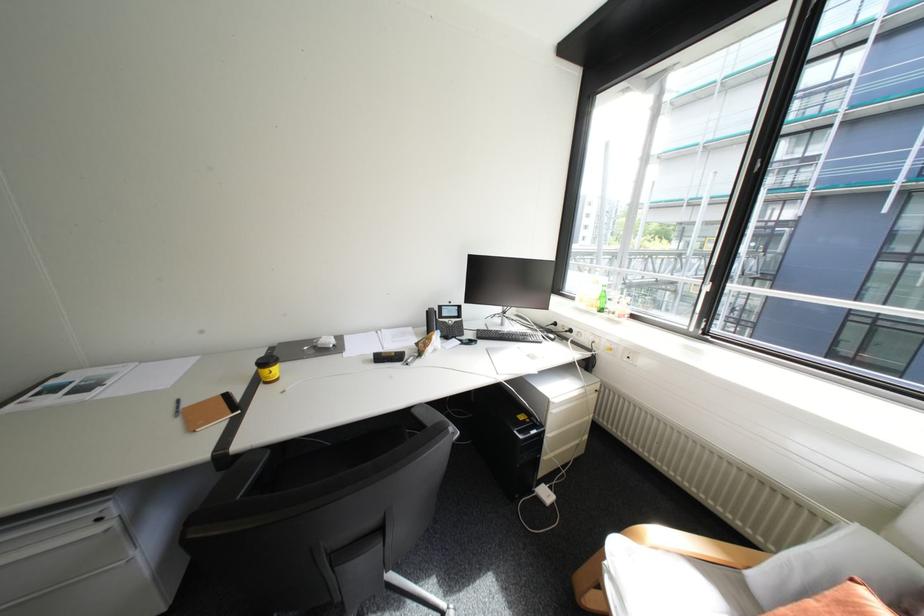
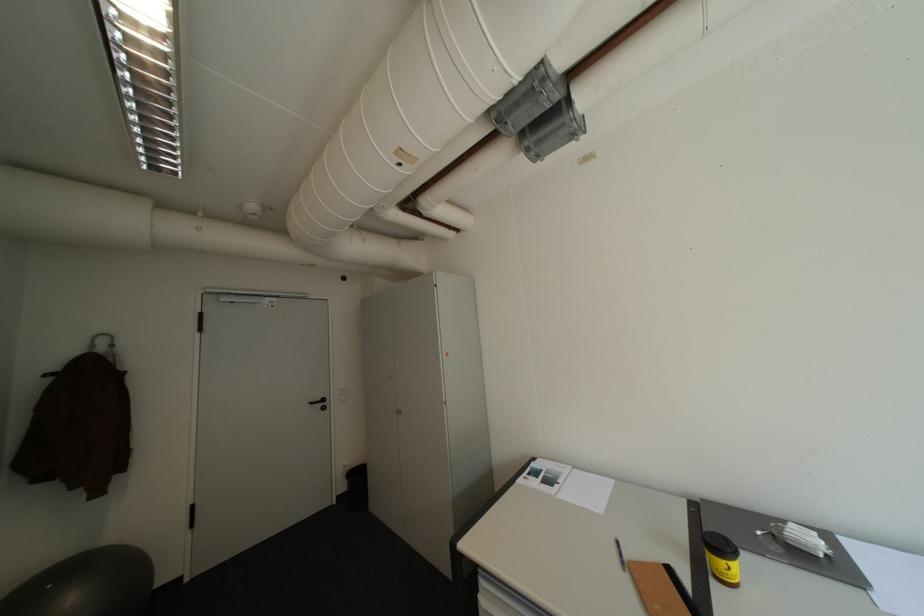
Where in the second image is the point corresponding to (x=272, y=387) from the first image?

(723, 584)